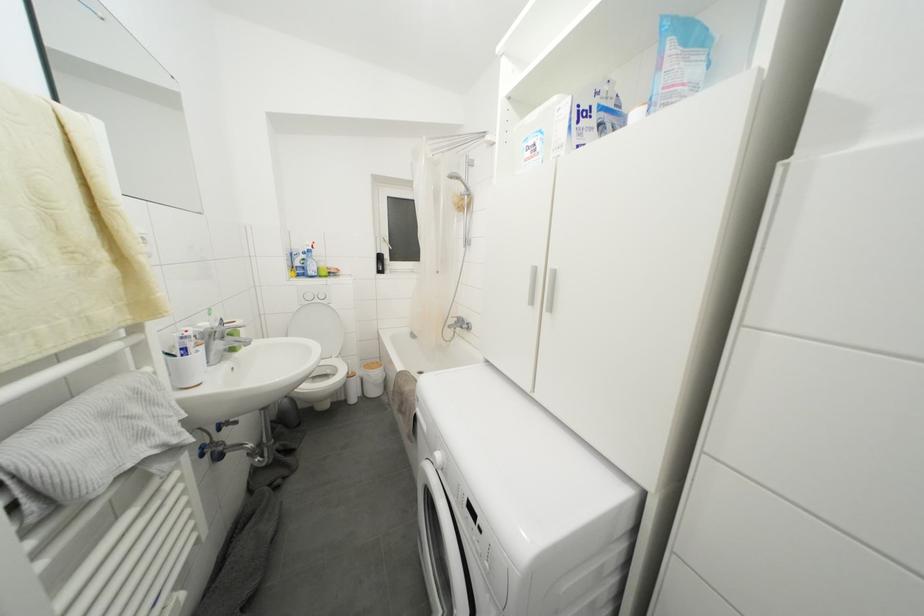
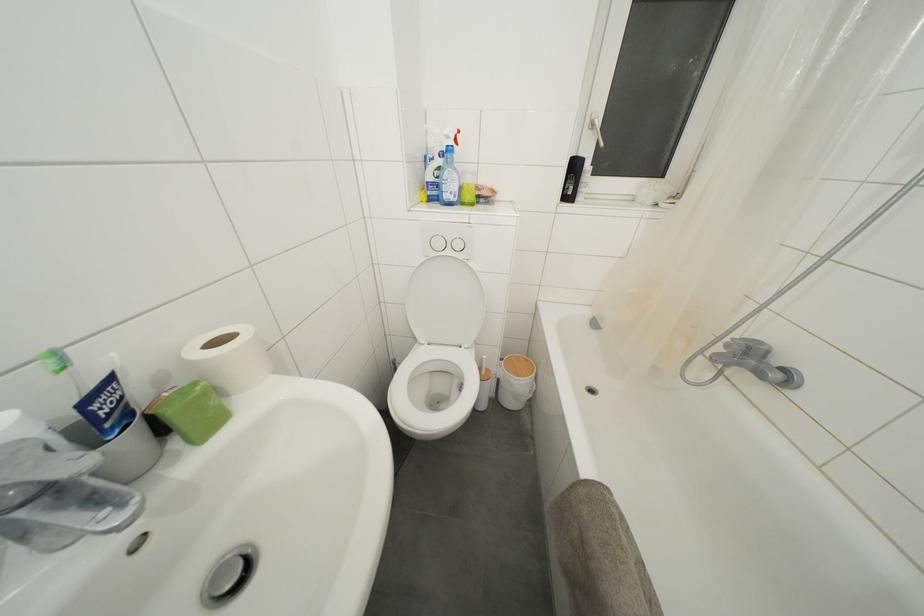
In the second image, find the point that corresponds to point (325, 301) in the first image.

(463, 251)